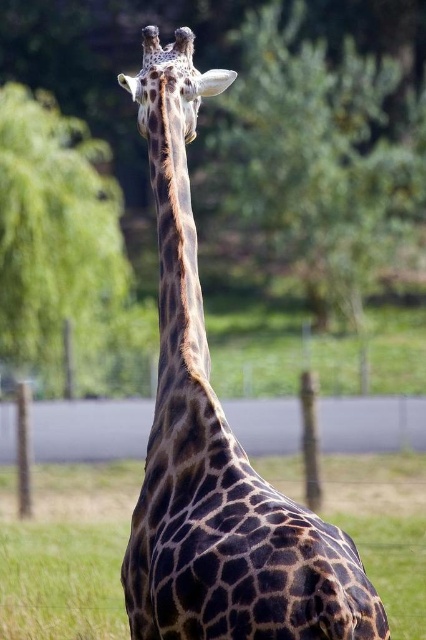
Question: Observing the image, what is the correct spatial positioning of spotted fur giraffe at center in reference to spotted fur head at upper center?

Choices:
 (A) left
 (B) right

Answer: (B)

Question: Which object is closer to the camera taking this photo?

Choices:
 (A) brown textured neck at center
 (B) green leafy tree at upper left
 (C) spotted fur giraffe at center
 (D) spotted fur head at upper center

Answer: (C)

Question: Estimate the real-world distances between objects in this image. Which object is closer to the brown textured neck at center?

Choices:
 (A) green leafy tree at upper left
 (B) spotted fur head at upper center
 (C) spotted fur giraffe at center

Answer: (C)

Question: Is green leafy tree at upper left to the left of spotted fur head at upper center from the viewer's perspective?

Choices:
 (A) no
 (B) yes

Answer: (B)

Question: Does green leafy tree at upper left appear on the right side of spotted fur head at upper center?

Choices:
 (A) yes
 (B) no

Answer: (B)

Question: Which of the following is the farthest from the observer?

Choices:
 (A) green leafy tree at upper left
 (B) spotted fur giraffe at center

Answer: (A)